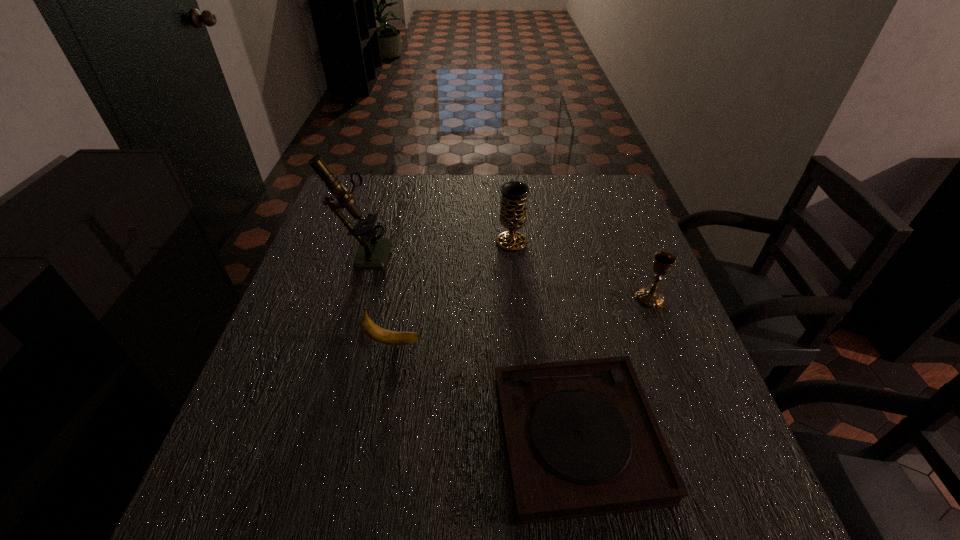
Where is `vacant region at the left edge of the desktop`? Image resolution: width=960 pixels, height=540 pixels. vacant region at the left edge of the desktop is located at coordinates (329, 274).

In order to click on free space at the right edge in this screenshot , I will do `click(584, 230)`.

In order to click on vacant area that lies between the farther chalice and the shortest object in this screenshot , I will do `click(544, 340)`.

The width and height of the screenshot is (960, 540). I want to click on free area in between the second tallest object and the microscope, so click(x=437, y=248).

This screenshot has width=960, height=540. I want to click on unoccupied position between the tallest object and the banana, so click(x=378, y=298).

Locate an element on the screen. free spot between the banana and the microscope is located at coordinates (378, 298).

This screenshot has width=960, height=540. I want to click on vacant area that lies between the taller chalice and the nearest object, so click(x=544, y=340).

Identify the location of free space between the third nearest object and the fourth farthest object. This screenshot has width=960, height=540. (521, 321).

The width and height of the screenshot is (960, 540). I want to click on free space between the rightmost object and the banana, so click(x=521, y=321).

Where is `vacant point located between the microscope and the fourth shortest object`? Image resolution: width=960 pixels, height=540 pixels. vacant point located between the microscope and the fourth shortest object is located at coordinates (437, 248).